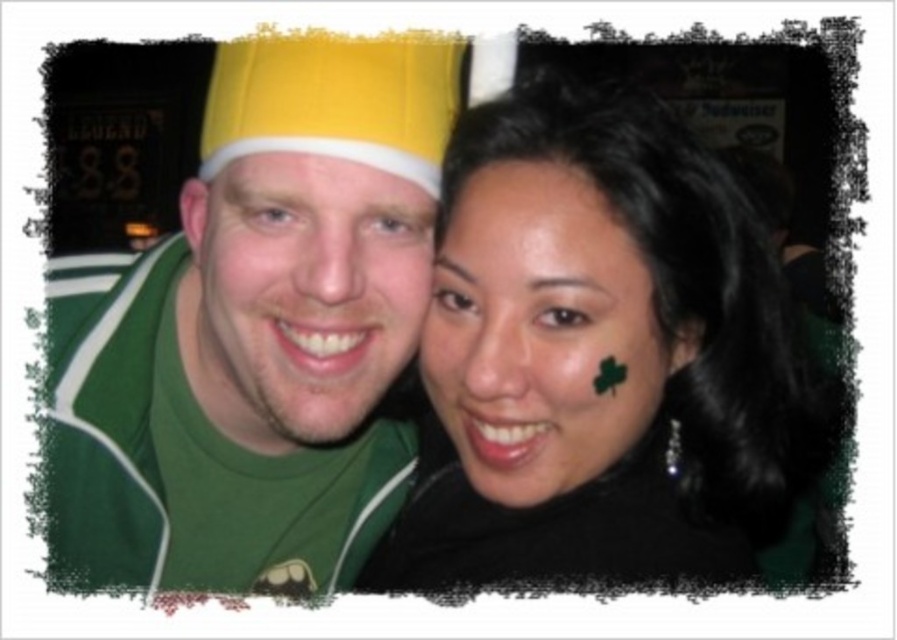
Is matte yellow hat at center wider than green matte face at center?

Correct, the width of matte yellow hat at center exceeds that of green matte face at center.

Is point (363, 404) positioned in front of point (248, 321)?

No, it is not.

The image size is (897, 640). What do you see at coordinates (258, 330) in the screenshot? I see `matte yellow hat at center` at bounding box center [258, 330].

The height and width of the screenshot is (640, 897). I want to click on matte yellow hat at center, so click(x=258, y=330).

Does green matte face paint at center appear on the left side of matte yellow cap at center?

Incorrect, green matte face paint at center is not on the left side of matte yellow cap at center.

Locate an element on the screen. Image resolution: width=897 pixels, height=640 pixels. green matte face paint at center is located at coordinates (541, 332).

This screenshot has height=640, width=897. What are the coordinates of `green matte face at center` in the screenshot? It's located at (300, 292).

Can you confirm if green matte face at center is thinner than green matte forehead at upper center?

Incorrect, green matte face at center's width is not less than green matte forehead at upper center's.

Is point (236, 417) farther from viewer compared to point (450, 180)?

Yes, it is.

At what (x,y) coordinates should I click in order to perform the action: click on green matte face at center. Please return your answer as a coordinate pair (x, y). Looking at the image, I should click on (300, 292).